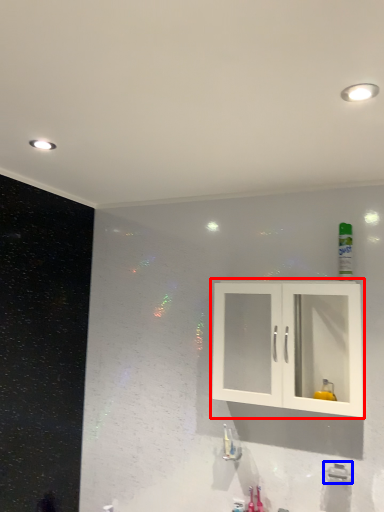
Question: Which of the following is the farthest to the observer, cabinetry (highlighted by a red box) or plumbing fixture (highlighted by a blue box)?

Choices:
 (A) cabinetry
 (B) plumbing fixture

Answer: (B)